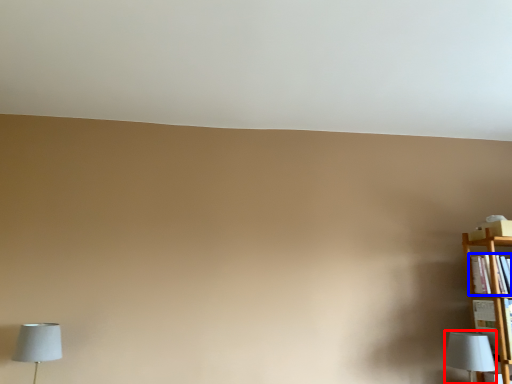
Question: Among these objects, which one is farthest to the camera, lamp (highlighted by a red box) or book (highlighted by a blue box)?

Choices:
 (A) lamp
 (B) book

Answer: (B)